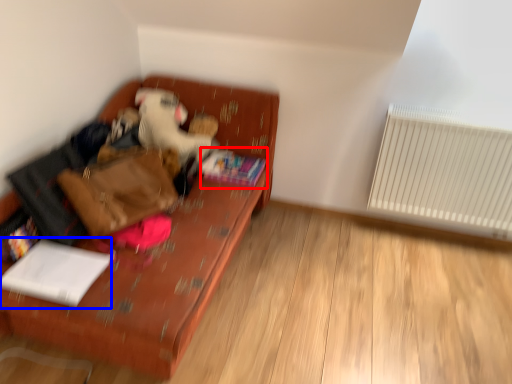
Question: Which of the following is the closest to the observer, book (highlighted by a red box) or book (highlighted by a blue box)?

Choices:
 (A) book
 (B) book

Answer: (B)